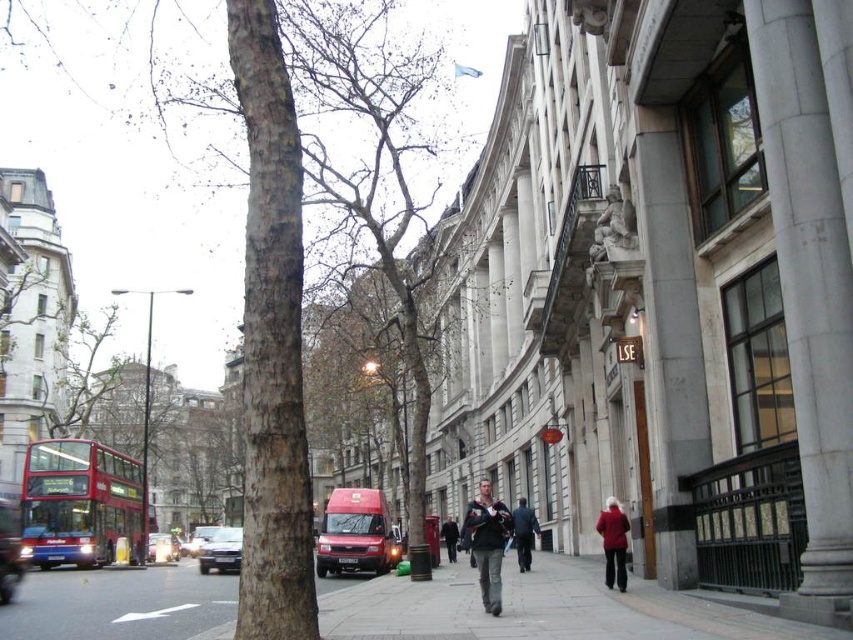
You are a delivery person who needs to park your metallic silver car at center on the gray concrete sidewalk at center. Can you fit your car completely on the sidewalk?

The gray concrete sidewalk at center is shorter than the metallic silver car at center, so the car cannot be fully parked on the sidewalk.